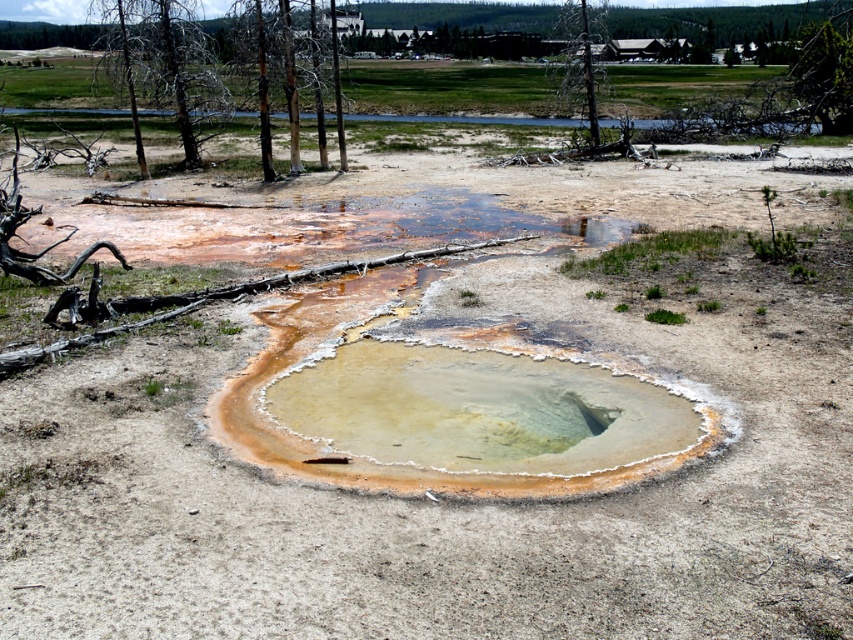
Question: Which object appears closest to the camera in this image?

Choices:
 (A) brown bark tree at upper left
 (B) green leafy tree at upper right

Answer: (A)

Question: Does brown bark tree at upper center have a lesser width compared to green leafy tree at upper right?

Choices:
 (A) no
 (B) yes

Answer: (A)

Question: Which of the following is the closest to the observer?

Choices:
 (A) (595, 52)
 (B) (820, 93)
 (C) (264, 122)

Answer: (C)

Question: Based on their relative distances, which object is farther from the brown bark tree at upper left?

Choices:
 (A) brown bark tree at upper center
 (B) green leafy tree at upper right

Answer: (B)

Question: Does brown bark tree at upper left have a smaller size compared to green leafy tree at upper right?

Choices:
 (A) no
 (B) yes

Answer: (A)

Question: Does brown bark tree at upper left have a smaller size compared to brown bark tree at upper center?

Choices:
 (A) yes
 (B) no

Answer: (B)